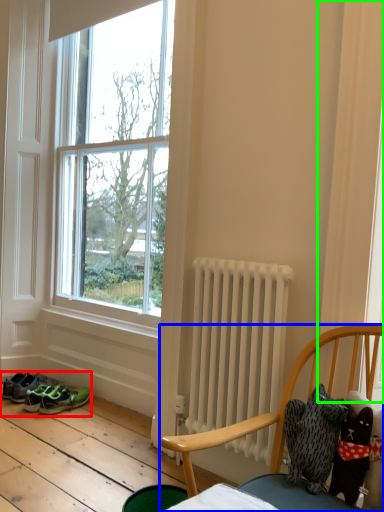
Question: Based on their relative distances, which object is farther from footwear (highlighted by a red box)? Choose from chair (highlighted by a blue box) and curtain (highlighted by a green box).

Choices:
 (A) chair
 (B) curtain

Answer: (B)